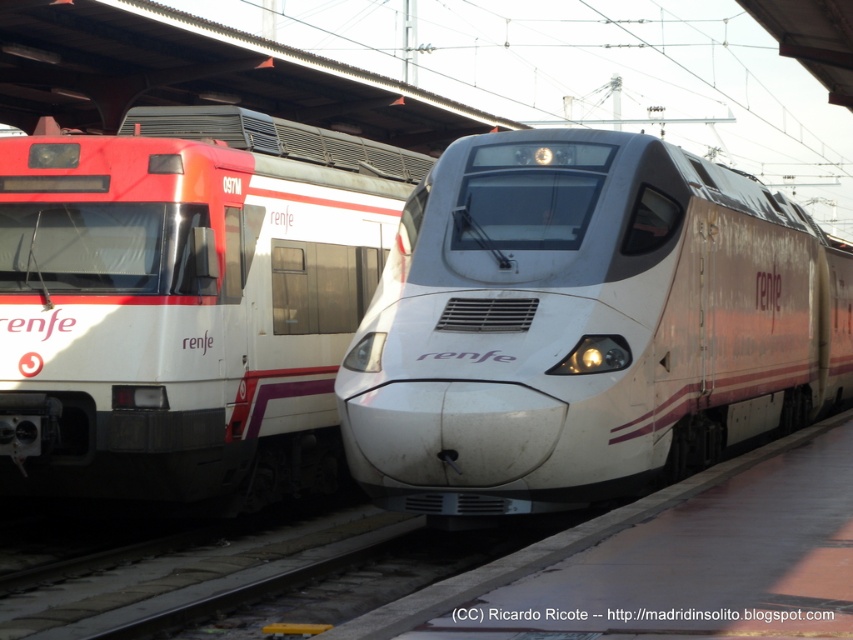
You are a photographer standing at the train station. You want to capture a photo where both the white glossy train at center and the white glossy train at left are visible in the frame. Considering their heights, which train will appear larger in the photo?

The white glossy train at center will appear larger in the photo because it is much taller than the white glossy train at left.

You are a maintenance worker needing to inspect both the white glossy train at center and the white glossy train at left. Given that your inspection equipment has a maximum reach of 10 feet, can you inspect both trains without moving your equipment? Please explain your reasoning.

The white glossy train at center and the white glossy train at left are 12.20 feet apart. Since the equipment has a maximum reach of 10 feet, it cannot span the distance between them. Therefore, you would need to move the equipment closer to either train to inspect both.

You are a passenger at the train station and want to board the white glossy train at center. From your current position, which direction should you walk to reach it first before the white glossy train at left?

The white glossy train at center is below the white glossy train at left, so you should walk downward to reach the white glossy train at center first before the white glossy train at left.